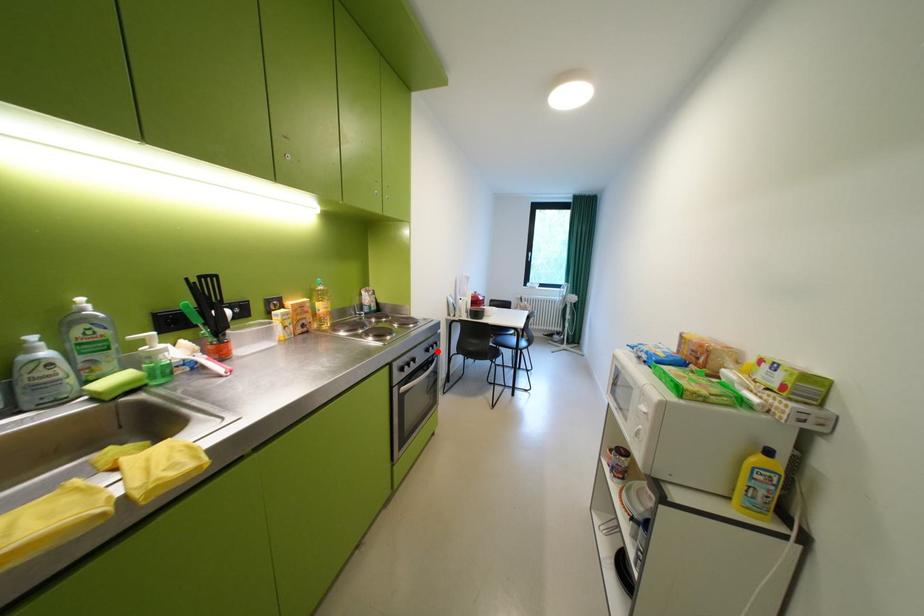
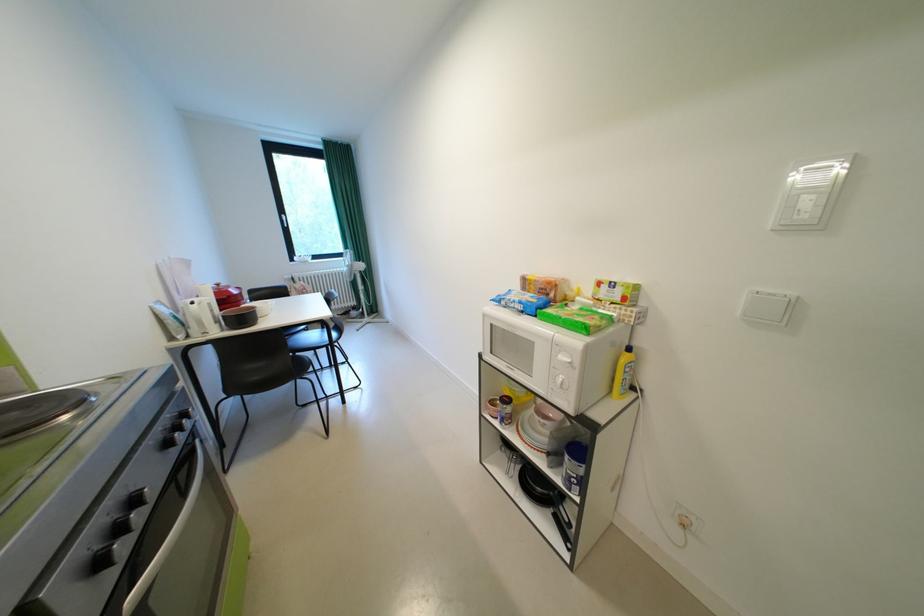
In the second image, find the point that corresponds to the highlighted location in the first image.

(176, 446)